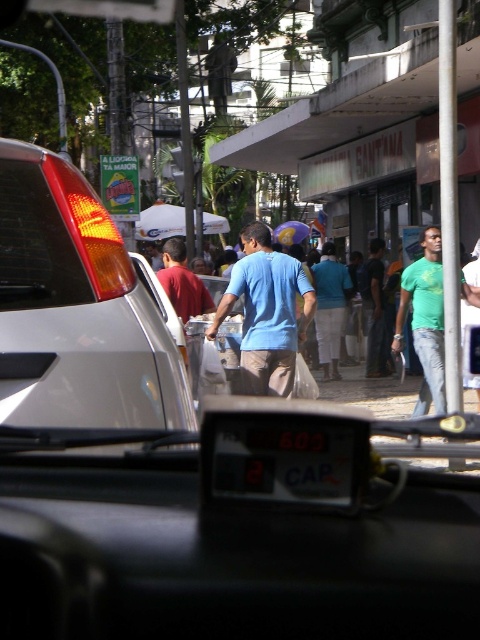
Can you confirm if matte silver car at left is positioned to the right of green matte shirt at center?

In fact, matte silver car at left is to the left of green matte shirt at center.

This screenshot has height=640, width=480. What do you see at coordinates (79, 308) in the screenshot?
I see `matte silver car at left` at bounding box center [79, 308].

Which is in front, point (49, 312) or point (424, 346)?

Point (49, 312)

Where is `matte silver car at left`? The image size is (480, 640). matte silver car at left is located at coordinates (79, 308).

Does point (358, 436) lie in front of point (239, 294)?

Yes, it is in front of point (239, 294).

Is point (220, 458) positioned after point (274, 268)?

No.

Is point (219, 433) closer to viewer compared to point (282, 371)?

Yes.

At what (x,y) coordinates should I click in order to perform the action: click on black plastic license plate at center. Please return your answer as a coordinate pair (x, y). Image resolution: width=480 pixels, height=640 pixels. Looking at the image, I should click on (287, 460).

Does point (255, 470) lie behind point (374, 296)?

No, (255, 470) is in front of (374, 296).

Does black plastic license plate at center lie in front of light blue shirt at center?

Yes, black plastic license plate at center is in front of light blue shirt at center.

Is point (324, 493) in front of point (377, 280)?

Yes, it is in front of point (377, 280).

Locate an element on the screen. The height and width of the screenshot is (640, 480). black plastic license plate at center is located at coordinates (287, 460).